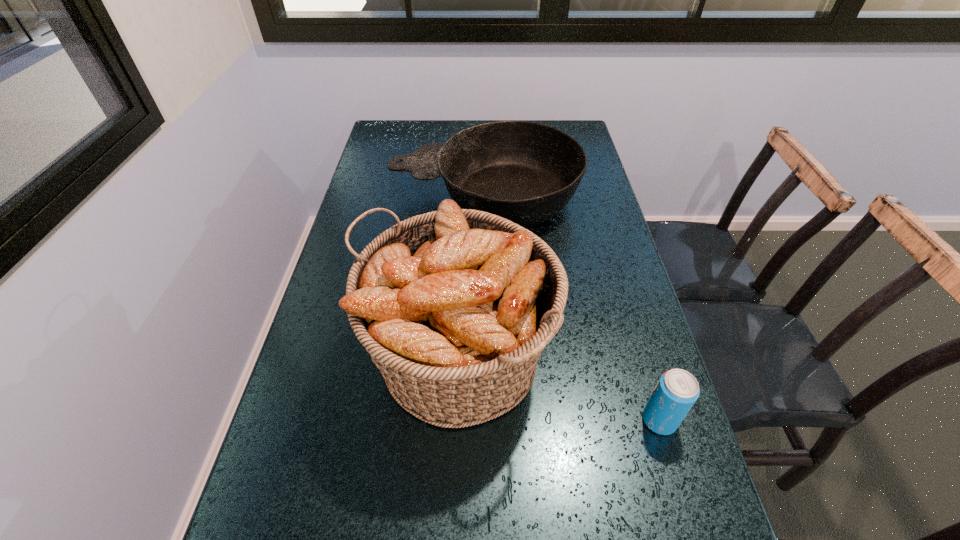
Locate an element on the screen. the tallest object is located at coordinates (455, 306).

What are the coordinates of `frying pan` in the screenshot? It's located at [x=525, y=172].

In order to click on soda can in this screenshot , I will do `click(677, 390)`.

Find the location of a particular element. vacant area located on the right of the tallest object is located at coordinates (580, 359).

Identify the location of free space located with the handle extending from the side of the frying pan. (359, 197).

This screenshot has width=960, height=540. What are the coordinates of `vacant space positioned with the handle extending from the side of the frying pan` in the screenshot? It's located at [x=369, y=197].

The image size is (960, 540). I want to click on vacant space located with the handle extending from the side of the frying pan, so click(359, 197).

At what (x,y) coordinates should I click in order to perform the action: click on vacant area situated 0.100m on the left of the soda can. Please return your answer as a coordinate pair (x, y). Looking at the image, I should click on (591, 420).

The width and height of the screenshot is (960, 540). Identify the location of basket that is positioned at the left edge. (455, 306).

This screenshot has width=960, height=540. What are the coordinates of `frying pan present at the left edge` in the screenshot? It's located at (525, 172).